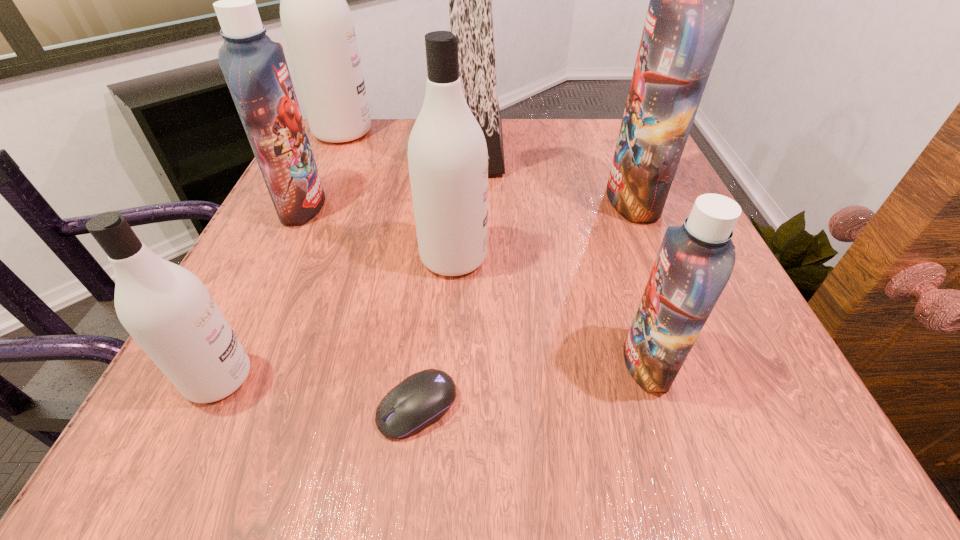
This screenshot has width=960, height=540. Identify the location of the shortest object. (423, 398).

Find the location of a particular element. The image size is (960, 540). free space located 0.350m on the front of the shopping bag with the design is located at coordinates (650, 146).

The image size is (960, 540). I want to click on vacant point located on the front-facing side of the farthest white shampoo, so [468, 132].

The width and height of the screenshot is (960, 540). I want to click on blank space located on the front label of the biggest blue shampoo, so click(x=411, y=199).

Where is `vacant area situated 0.140m on the front label of the biggest blue shampoo`? vacant area situated 0.140m on the front label of the biggest blue shampoo is located at coordinates pos(539,199).

This screenshot has height=540, width=960. What are the coordinates of `vacant space situated 0.100m on the front label of the biggest blue shampoo` in the screenshot? It's located at (558, 199).

I want to click on vacant region located on the front label of the leftmost blue shampoo, so click(x=469, y=206).

Identify the location of vacant position located on the front-facing side of the rightmost white shampoo. (652, 257).

Find the location of a particular element. The image size is (960, 540). free spot located 0.130m on the front label of the nearest blue shampoo is located at coordinates (532, 362).

Where is `vacant area located 0.180m on the front label of the nearest blue shampoo`? The image size is (960, 540). vacant area located 0.180m on the front label of the nearest blue shampoo is located at coordinates (496, 362).